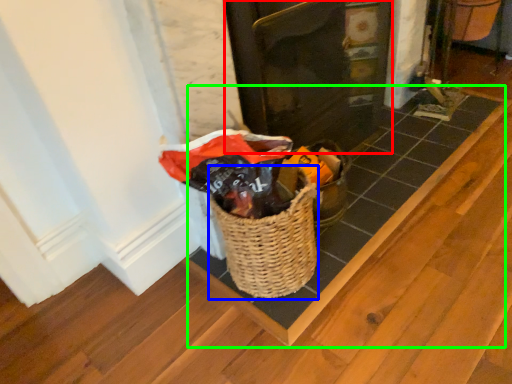
Question: Based on their relative distances, which object is farther from door (highlighted by a red box)? Choose from basket (highlighted by a blue box) and plank (highlighted by a green box).

Choices:
 (A) basket
 (B) plank

Answer: (A)